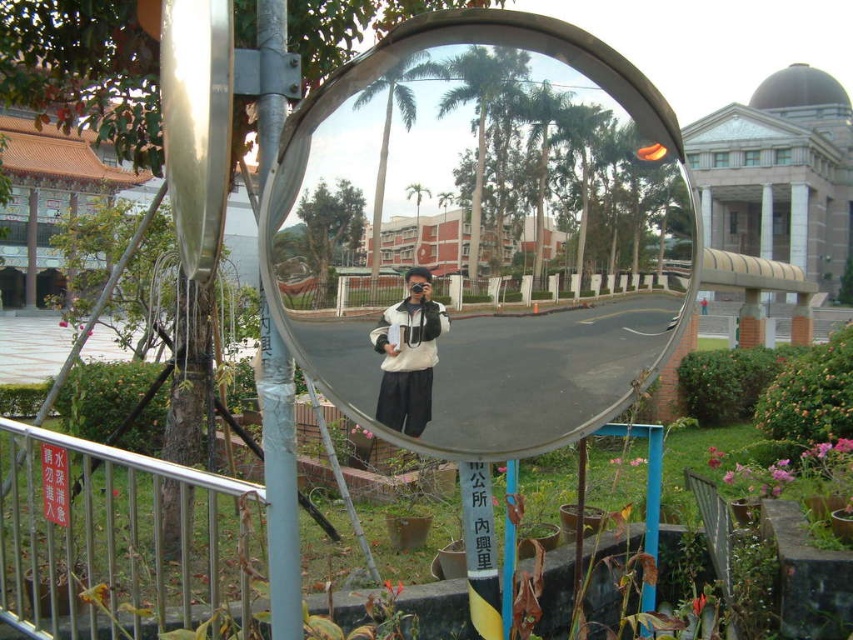
You are standing in front of the convex traffic mirror mounted on a metal pole. You notice a point at coordinates (480,234). Where is this point located?

The point at coordinates (480,234) is located on the clear glass mirror at center.

You are a photographer standing in front of the clear glass mirror at center and the white matte jacket at center. You want to capture a photo where both objects are in focus. The camera you are using has a depth of field that can only sharply focus on objects within a 9.5 inch range. Can you take the photo without adjusting your position?

The clear glass mirror at center is 10.05 inches away from the white matte jacket at center. Since the distance between them exceeds the camera s 9.5 inch depth of field range, you cannot take the photo without adjusting your position to reduce the distance between the two objects.

You are a photographer trying to capture a reflection in the clear glass mirror at center. You notice the white matte jacket at center might be blocking part of the reflection. Based on their sizes, can you determine if the jacket is entirely within the mirror or if part of it extends beyond the mirror?

The clear glass mirror at center is larger in size than the white matte jacket at center, so the jacket is entirely within the mirror and does not extend beyond it.